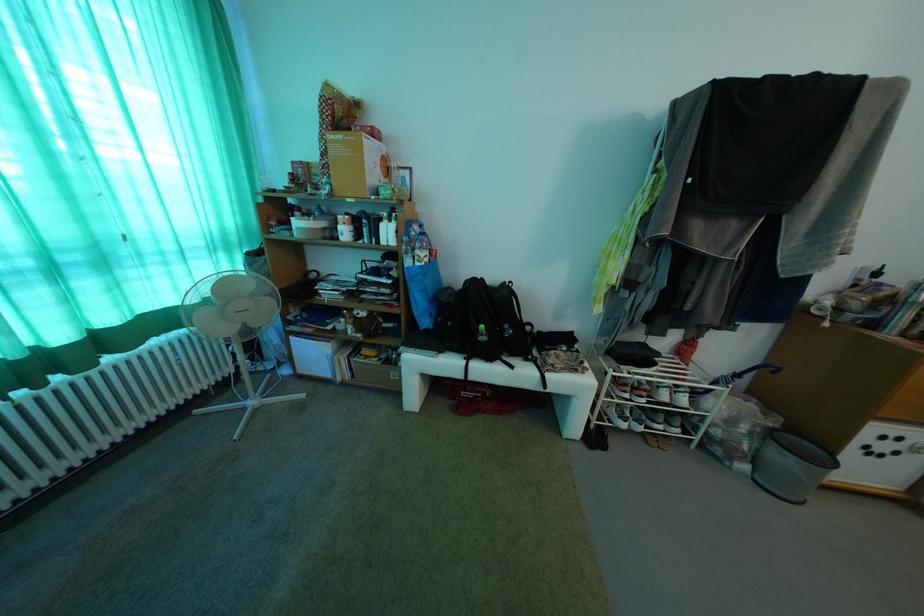
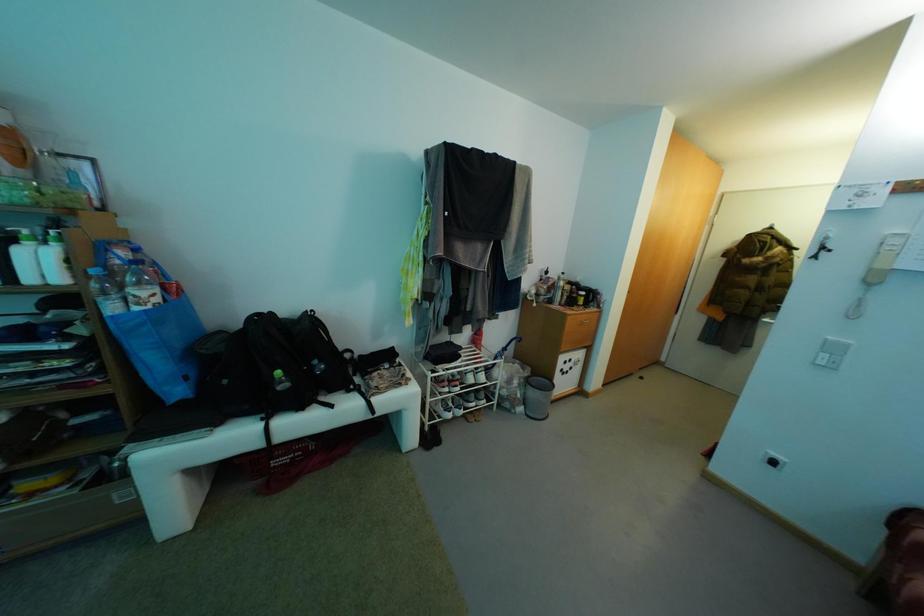
Question: The images are taken continuously from a first-person perspective. In which direction is your viewpoint rotating?

Choices:
 (A) Left
 (B) Right
 (C) Up
 (D) Down

Answer: (B)